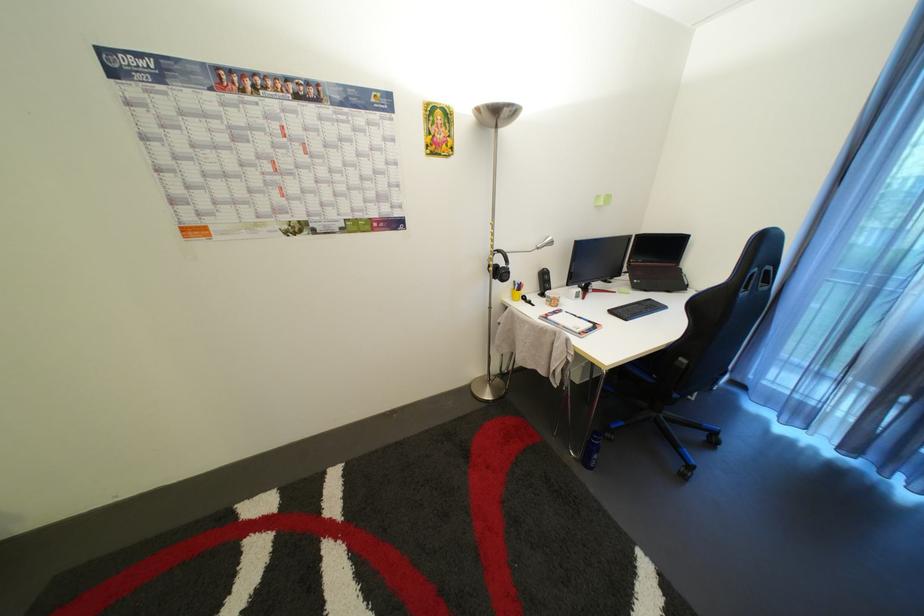
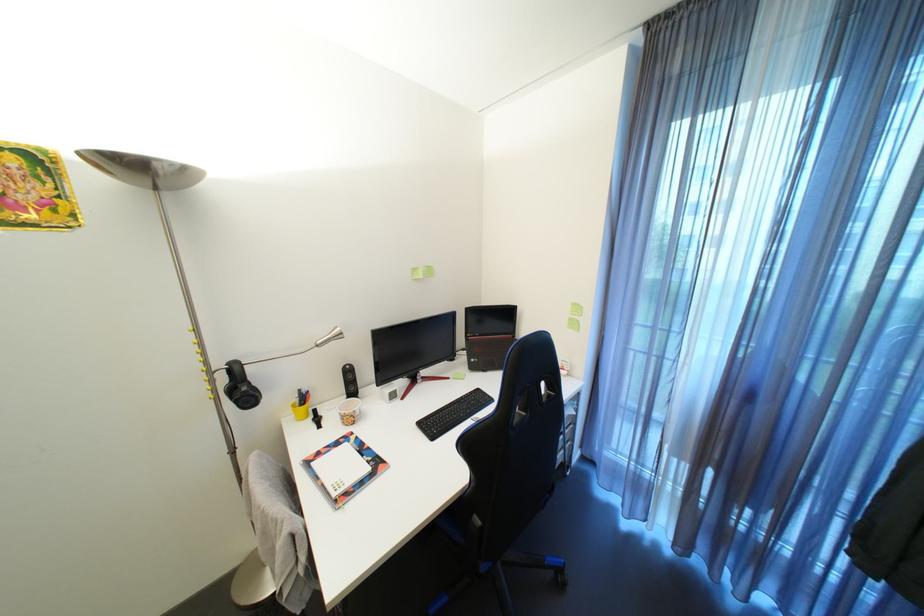
Question: The camera is either moving clockwise (left) or counter-clockwise (right) around the object. The first image is from the beginning of the video and the second image is from the end. Is the camera moving left or right when shooting the video?

Choices:
 (A) Left
 (B) Right

Answer: (A)